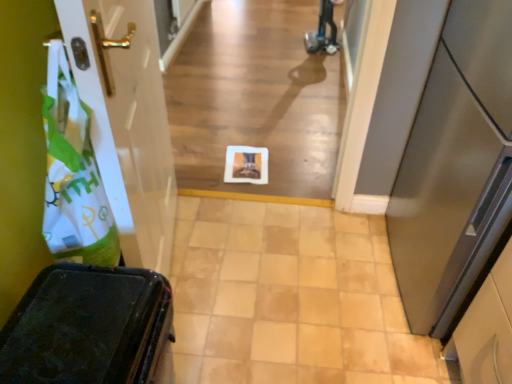
Where is `vacant space situated above beige tile floor at center (from a real-world perspective)`? Image resolution: width=512 pixels, height=384 pixels. vacant space situated above beige tile floor at center (from a real-world perspective) is located at coordinates (302, 282).